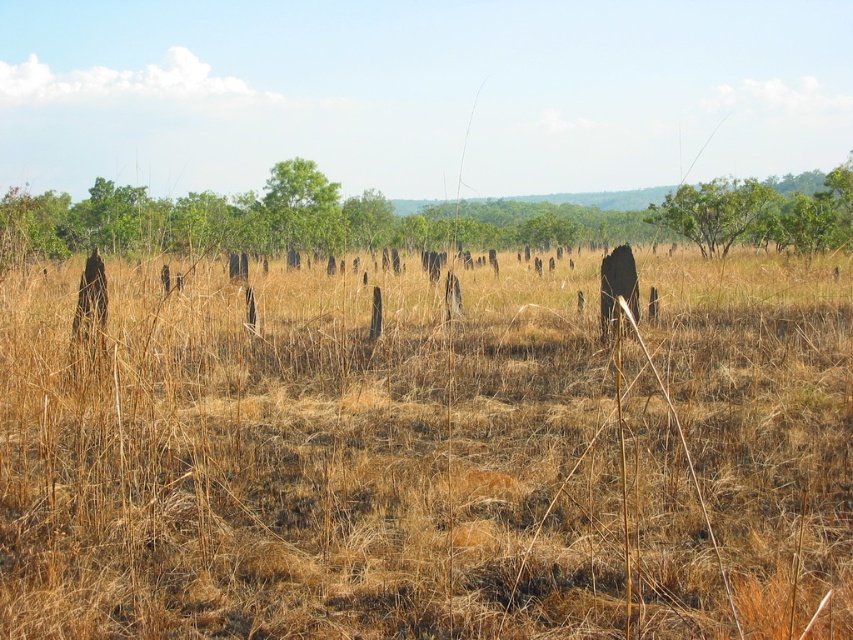
Does brown wood tree at center appear on the left side of green matte tree at upper center?

Incorrect, brown wood tree at center is not on the left side of green matte tree at upper center.

Who is positioned more to the left, brown wood tree at center or green matte tree at upper center?

green matte tree at upper center

You are a GUI agent. You are given a task and a screenshot of the screen. Output one action in this format:
    pyautogui.click(x=<x>, y=<y>)
    Task: Click on the brown wood tree at center
    
    Given the screenshot: What is the action you would take?
    pyautogui.click(x=421, y=218)

Can you confirm if brown dry grass at center is positioned above green leafy tree at upper right?

No.

Between point (334, 448) and point (751, 189), which one is positioned in front?

Point (334, 448)

This screenshot has height=640, width=853. In order to click on brown dry grass at center in this screenshot , I will do `click(427, 452)`.

Who is more distant from viewer, (125, 436) or (316, 180)?

Positioned behind is point (316, 180).

Who is taller, brown dry grass at center or green matte tree at upper center?

With more height is green matte tree at upper center.

Is point (305, 340) behind point (303, 173)?

No, it is in front of (303, 173).

In order to click on brown dry grass at center in this screenshot , I will do coord(427,452).